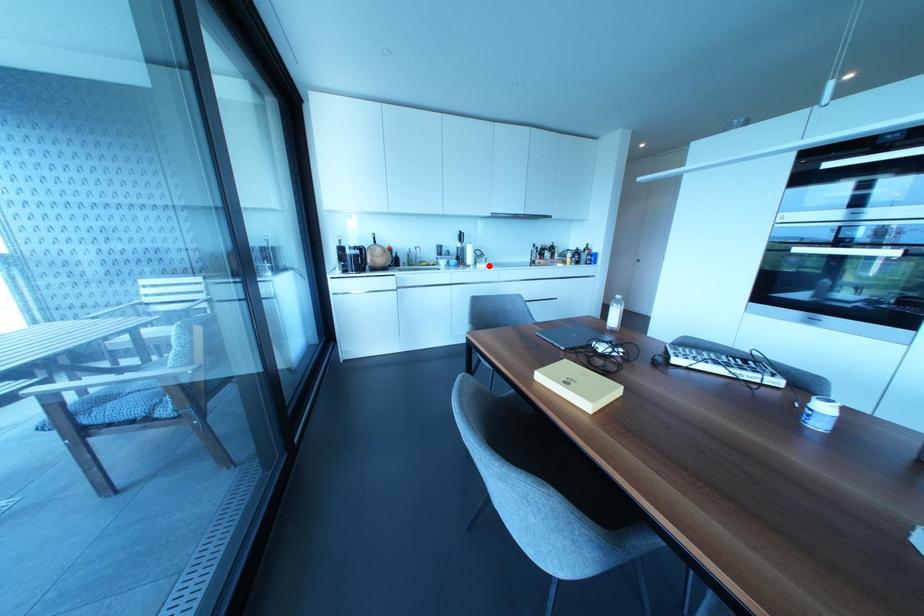
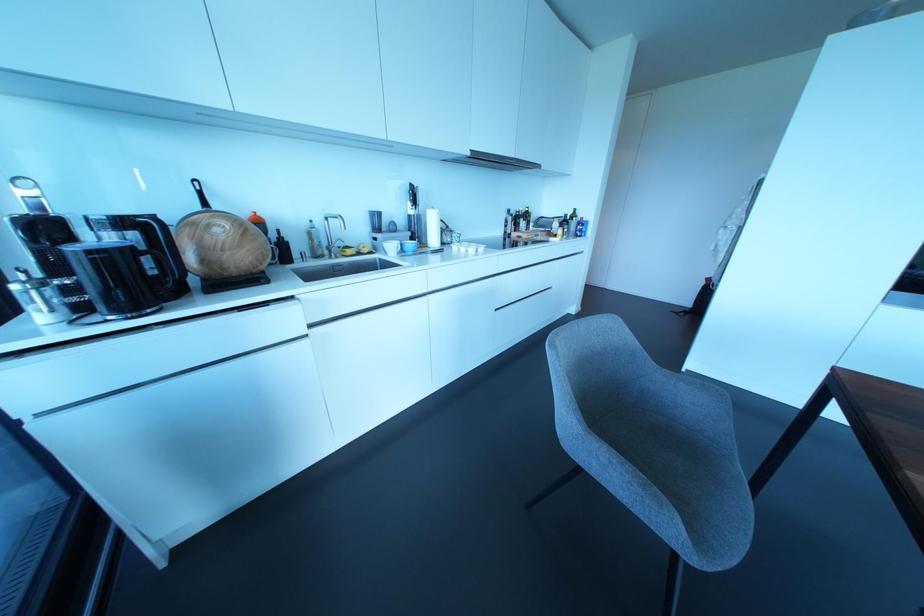
Where in the second image is the point corresponding to the highlighted location from the first image?

(480, 249)